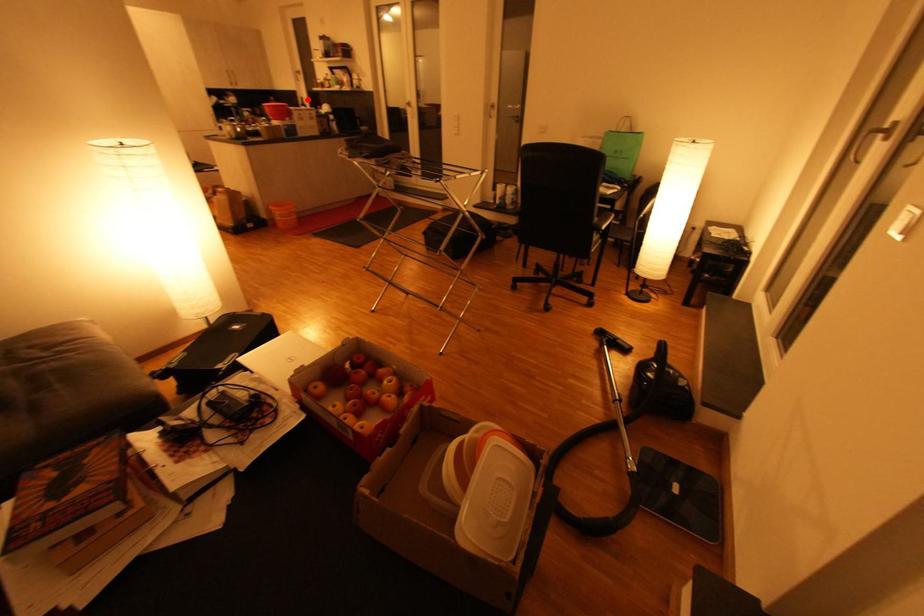
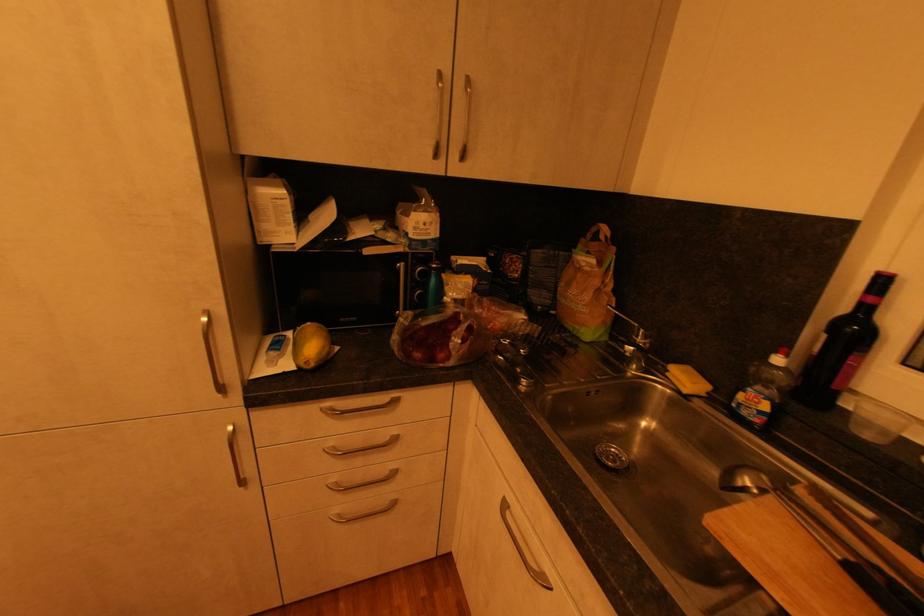
Question: I am providing you with two images of the same scene from different viewpoints. A red point is marked on the first image. Is the red point's position out of view in image 2?

Choices:
 (A) Yes
 (B) No

Answer: (B)